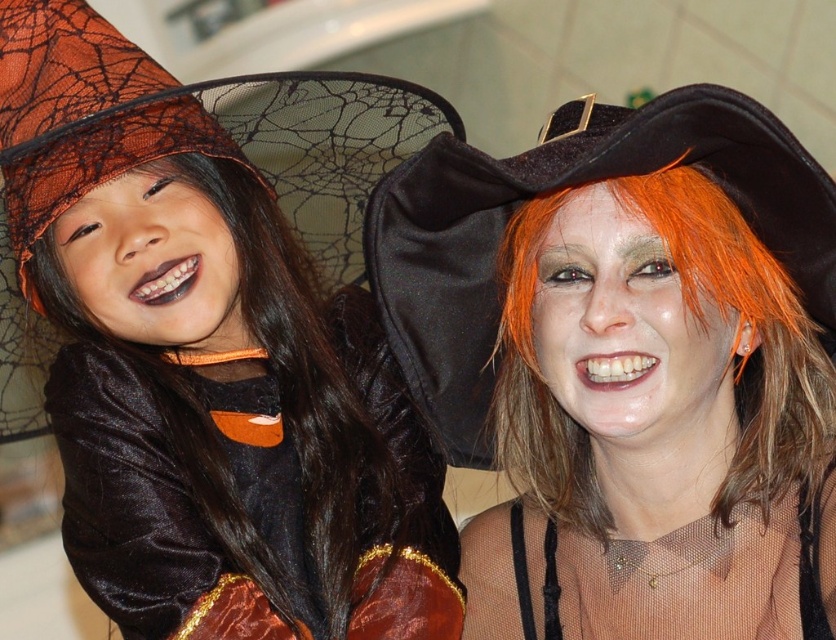
Consider the image. Does velvet black dress at left have a greater height compared to black velvet witch hat at upper right?

No, velvet black dress at left is not taller than black velvet witch hat at upper right.

Does velvet black dress at left have a greater width compared to black velvet witch hat at upper right?

No, velvet black dress at left is not wider than black velvet witch hat at upper right.

Is point (242, 445) farther from camera compared to point (378, 243)?

No, (242, 445) is in front of (378, 243).

Identify the location of velvet black dress at left. The image size is (836, 640). (248, 493).

From the picture: Who is positioned more to the left, matte black witch hat at upper left or velvet black dress at left?

matte black witch hat at upper left is more to the left.

Is matte black witch hat at upper left taller than velvet black dress at left?

Indeed, matte black witch hat at upper left has a greater height compared to velvet black dress at left.

Who is more forward, (329, 300) or (172, 480)?

Positioned in front is point (172, 480).

The width and height of the screenshot is (836, 640). Identify the location of matte black witch hat at upper left. (201, 368).

Can you confirm if matte black witch hat at upper left is wider than black velvet witch hat at upper right?

Indeed, matte black witch hat at upper left has a greater width compared to black velvet witch hat at upper right.

Is point (32, 320) farther from viewer compared to point (464, 332)?

No, it is not.

Between point (353, 323) and point (740, 150), which one is positioned in front?

Positioned in front is point (740, 150).

This screenshot has width=836, height=640. What are the coordinates of `matte black witch hat at upper left` in the screenshot? It's located at (201, 368).